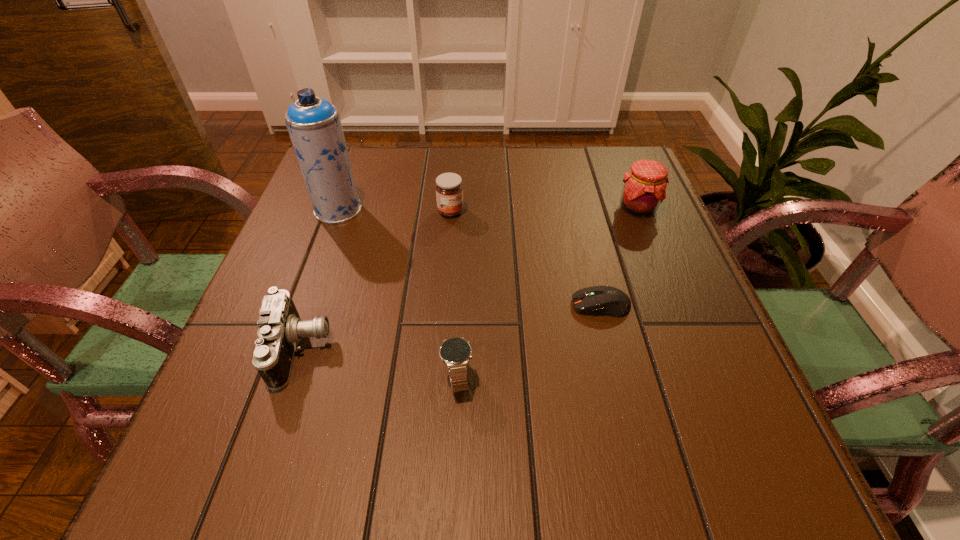
This screenshot has height=540, width=960. I want to click on vacant space positioned on the left of the shorter jam, so click(403, 211).

At what (x,y) coordinates should I click in order to perform the action: click on vacant space located at the lens of the camera. Please return your answer as a coordinate pair (x, y). This screenshot has width=960, height=540. Looking at the image, I should click on (542, 350).

Find the location of a particular element. This screenshot has height=540, width=960. free space located on the back of the watch is located at coordinates (460, 315).

The image size is (960, 540). In order to click on vacant position located 0.060m on the button of the shortest object in this screenshot , I will do `click(540, 305)`.

Where is `vacant point located on the button of the shortest object`? Image resolution: width=960 pixels, height=540 pixels. vacant point located on the button of the shortest object is located at coordinates (404, 305).

Find the location of a particular element. vacant space situated 0.120m on the button of the shortest object is located at coordinates (509, 305).

Find the location of `aerosol can that is positioned at the far edge`. aerosol can that is positioned at the far edge is located at coordinates (314, 126).

Locate an element on the screen. This screenshot has height=540, width=960. jam that is at the far edge is located at coordinates (644, 188).

Where is `aerosol can that is at the left edge`? The width and height of the screenshot is (960, 540). aerosol can that is at the left edge is located at coordinates (314, 126).

This screenshot has height=540, width=960. Identify the location of camera that is at the left edge. (280, 329).